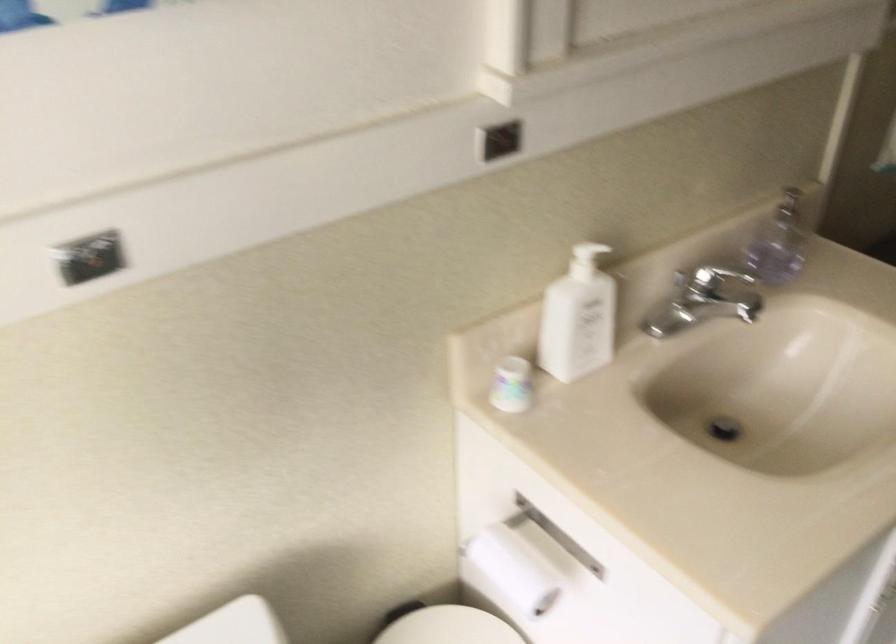
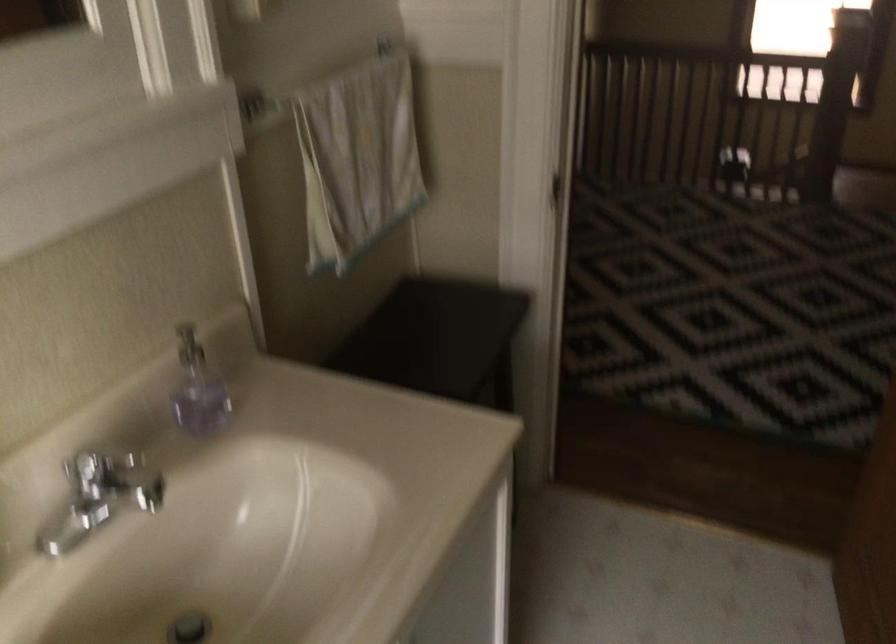
Question: How did the camera likely rotate?

Choices:
 (A) Left
 (B) Right
 (C) Up
 (D) Down

Answer: (B)